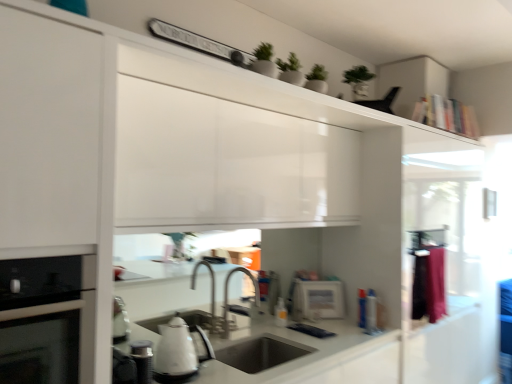
Locate an element on the screen. The height and width of the screenshot is (384, 512). black glass oven at left is located at coordinates (49, 320).

In order to face white glossy kettle at lower left, which ranks as the first appliance in front-to-back order, should I rotate leftwards or rightwards?

Rotate your view left by about 15.007°.

The height and width of the screenshot is (384, 512). I want to click on matte stainless steel sink at center, so click(261, 353).

I want to click on wooden sign at upper center, which ranks as the third appliance in bottom-to-top order, so click(198, 42).

Does white glossy kettle at lower center have a lesser height compared to translucent plastic bottle at sink?

No.

Find the location of `bottle on the right of the white glossy kettle at lower center`. bottle on the right of the white glossy kettle at lower center is located at coordinates (281, 313).

From a real-world perspective, is white glossy kettle at lower center physically located above or below translucent plastic bottle at sink?

In terms of real-world spatial position, white glossy kettle at lower center is above translucent plastic bottle at sink.

Which point is more distant from viewer, (x=187, y=374) or (x=278, y=319)?

The point (x=278, y=319) is farther.

Consider the image. Is matte stainless steel sink at center wider than white glossy microwave at center, acting as the first appliance starting from the right?

Yes, matte stainless steel sink at center is wider than white glossy microwave at center, acting as the first appliance starting from the right.

From a real-world perspective, who is located higher, matte stainless steel sink at center or white glossy microwave at center, the third appliance viewed from the top?

white glossy microwave at center, the third appliance viewed from the top, is physically above.

From the image's perspective, which one is positioned lower, matte stainless steel sink at center or white glossy microwave at center, which is the 1th appliance in bottom-to-top order?

matte stainless steel sink at center, from the image's perspective.

Is matte stainless steel sink at center in contact with white glossy microwave at center, the 3th appliance positioned from the front?

No, matte stainless steel sink at center is not touching white glossy microwave at center, the 3th appliance positioned from the front.

In terms of height, does silver metallic faucet at center look taller or shorter compared to pink fabric at right?

Considering their sizes, silver metallic faucet at center has less height than pink fabric at right.

Does point (230, 273) come in front of point (438, 255)?

No.

Is silver metallic faucet at center facing away from pink fabric at right?

No, silver metallic faucet at center's orientation is not away from pink fabric at right.

How much distance is there between silver metallic faucet at center and pink fabric at right?

A distance of 3.70 feet exists between silver metallic faucet at center and pink fabric at right.

Based on their sizes in the image, would you say white glossy microwave at center, the 3th appliance positioned from the front, is bigger or smaller than silver metallic faucet at center?

white glossy microwave at center, the 3th appliance positioned from the front, is smaller than silver metallic faucet at center.

How different are the orientations of white glossy microwave at center, the first appliance viewed from the back, and silver metallic faucet at center in degrees?

The angle between the facing direction of white glossy microwave at center, the first appliance viewed from the back, and the facing direction of silver metallic faucet at center is 35.9 degrees.

Is white glossy microwave at center, which ranks as the 3th appliance in left-to-right order, further to the viewer compared to silver metallic faucet at center?

Yes, it is behind silver metallic faucet at center.

Is point (301, 292) farther from camera compared to point (227, 304)?

Yes, point (301, 292) is behind point (227, 304).

From a real-world perspective, is pink fabric at right over white glossy microwave at center, the 3th appliance positioned from the front?

Yes, from a real-world perspective, pink fabric at right is over white glossy microwave at center, the 3th appliance positioned from the front

Considering the relative positions of pink fabric at right and white glossy microwave at center, which ranks as the 3th appliance in left-to-right order, in the image provided, is pink fabric at right in front of white glossy microwave at center, which ranks as the 3th appliance in left-to-right order,?

That is True.

Does pink fabric at right have a greater height compared to white glossy microwave at center, acting as the first appliance starting from the right?

Yes, pink fabric at right is taller than white glossy microwave at center, acting as the first appliance starting from the right.

Looking at their sizes, would you say white glossy kettle at lower center is wider or thinner than matte stainless steel sink at center?

Considering their sizes, white glossy kettle at lower center looks slimmer than matte stainless steel sink at center.

From a real-world perspective, which object rests below the other?

matte stainless steel sink at center is physically lower.

At what (x,y) coordinates should I click in order to perform the action: click on sink lying below the white glossy kettle at lower center (from the image's perspective). Please return your answer as a coordinate pair (x, y). Looking at the image, I should click on (261, 353).

Are white glossy kettle at lower center and matte stainless steel sink at center beside each other?

No, white glossy kettle at lower center is not in contact with matte stainless steel sink at center.

Based on their positions, is translucent plastic bottle at sink located to the left or right of matte stainless steel sink at center?

From the image, it's evident that translucent plastic bottle at sink is to the right of matte stainless steel sink at center.

Are translucent plastic bottle at sink and matte stainless steel sink at center beside each other?

No.

From the picture: Considering the relative sizes of translucent plastic bottle at sink and matte stainless steel sink at center in the image provided, is translucent plastic bottle at sink shorter than matte stainless steel sink at center?

Indeed, translucent plastic bottle at sink has a lesser height compared to matte stainless steel sink at center.

Where is `bottle that is on the right side of white glossy kettle at lower center`? Image resolution: width=512 pixels, height=384 pixels. bottle that is on the right side of white glossy kettle at lower center is located at coordinates (281, 313).

The image size is (512, 384). Identify the location of appliance that is the 2nd object above the matte stainless steel sink at center (from a real-world perspective). (317, 300).

Estimate the real-world distances between objects in this image. Which object is closer to wooden sign at upper center, acting as the 2th appliance starting from the left, black glass oven at left or white glossy microwave at center, the first appliance viewed from the back?

Based on the image, black glass oven at left appears to be nearer to wooden sign at upper center, acting as the 2th appliance starting from the left.

Estimate the real-world distances between objects in this image. Which object is closer to wooden sign at upper center, which is the 1th appliance in top-to-bottom order, translucent plastic bottle at sink or silver metallic faucet at center?

translucent plastic bottle at sink lies closer to wooden sign at upper center, which is the 1th appliance in top-to-bottom order, than the other object.

When comparing their distances from matte stainless steel sink at center, does pink fabric at right or silver metallic faucet at center seem closer?

Based on the image, silver metallic faucet at center appears to be nearer to matte stainless steel sink at center.

Which object lies nearer to the anchor point matte stainless steel sink at center, pink fabric at right or translucent plastic bottle at sink?

Based on the image, translucent plastic bottle at sink appears to be nearer to matte stainless steel sink at center.

Which object lies nearer to the anchor point white glossy kettle at lower left, acting as the 1th appliance starting from the left, wooden sign at upper center, which is counted as the 2th appliance, starting from the back, or white glossy microwave at center, the first appliance viewed from the back?

white glossy microwave at center, the first appliance viewed from the back, lies closer to white glossy kettle at lower left, acting as the 1th appliance starting from the left, than the other object.

From the image, which object appears to be nearer to silver metallic faucet at center, pink fabric at right or white glossy kettle at lower center?

white glossy kettle at lower center is positioned closer to the anchor silver metallic faucet at center.

Estimate the real-world distances between objects in this image. Which object is further from white glossy microwave at center, the first appliance viewed from the back, pink fabric at right or white glossy kettle at lower left, the 2th appliance positioned from the bottom?

white glossy kettle at lower left, the 2th appliance positioned from the bottom, is further to white glossy microwave at center, the first appliance viewed from the back.

Which object lies nearer to the anchor point silver metallic faucet at center, white glossy microwave at center, the 3th appliance positioned from the front, or white glossy kettle at lower left, which ranks as the first appliance in front-to-back order?

Among the two, white glossy microwave at center, the 3th appliance positioned from the front, is located nearer to silver metallic faucet at center.

Where is `bottle between wooden sign at upper center, acting as the 2th appliance starting from the left, and matte stainless steel sink at center in the up-down direction`? The width and height of the screenshot is (512, 384). bottle between wooden sign at upper center, acting as the 2th appliance starting from the left, and matte stainless steel sink at center in the up-down direction is located at coordinates (281, 313).

Where is `tap between wooden sign at upper center, which is counted as the 2th appliance, starting from the back, and white glossy kettle at lower center from top to bottom`? tap between wooden sign at upper center, which is counted as the 2th appliance, starting from the back, and white glossy kettle at lower center from top to bottom is located at coordinates click(228, 295).

The image size is (512, 384). I want to click on tap between wooden sign at upper center, which is the 1th appliance in top-to-bottom order, and white glossy kettle at lower left, which is the 3th appliance from back to front, in the vertical direction, so click(x=228, y=295).

You are a GUI agent. You are given a task and a screenshot of the screen. Output one action in this format:
    pyautogui.click(x=<x>, y=<y>)
    Task: Click on the kitchen appliance between wooden sign at upper center, marked as the second appliance in a right-to-left arrangement, and matte stainless steel sink at center vertically
    
    Given the screenshot: What is the action you would take?
    pyautogui.click(x=179, y=351)